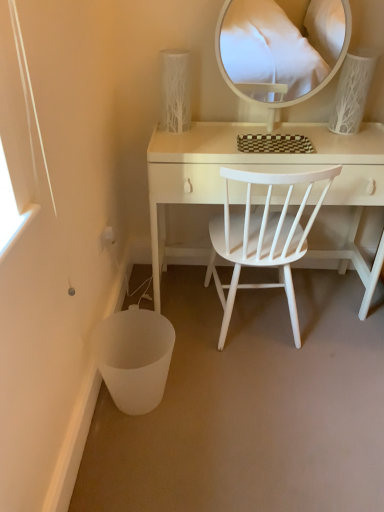
Question: From a real-world perspective, is white textured vase at upper center, the 2th table lamp viewed from the right, under white wood desk at center?

Choices:
 (A) yes
 (B) no

Answer: (B)

Question: Considering the relative sizes of white textured vase at upper center, which ranks as the 1th table lamp in left-to-right order, and white wood desk at center in the image provided, is white textured vase at upper center, which ranks as the 1th table lamp in left-to-right order, thinner than white wood desk at center?

Choices:
 (A) yes
 (B) no

Answer: (A)

Question: Is white textured vase at upper center, the 2th table lamp viewed from the right, positioned with its back to white wood desk at center?

Choices:
 (A) yes
 (B) no

Answer: (B)

Question: Is white textured vase at upper center, which ranks as the 1th table lamp in left-to-right order, smaller than white wood desk at center?

Choices:
 (A) yes
 (B) no

Answer: (A)

Question: Are white textured vase at upper center, which ranks as the 1th table lamp in left-to-right order, and white wood desk at center far apart?

Choices:
 (A) no
 (B) yes

Answer: (A)

Question: Which is correct: white wood chair at center is inside white textured vase at upper center, the 2th table lamp viewed from the right, or outside of it?

Choices:
 (A) inside
 (B) outside

Answer: (B)

Question: Looking at their shapes, would you say white wood chair at center is wider or thinner than white textured vase at upper center, which ranks as the 1th table lamp in left-to-right order?

Choices:
 (A) thin
 (B) wide

Answer: (B)

Question: In terms of height, does white wood chair at center look taller or shorter compared to white textured vase at upper center, the 2th table lamp viewed from the right?

Choices:
 (A) short
 (B) tall

Answer: (B)

Question: Is white wood chair at center bigger or smaller than white textured vase at upper center, the 2th table lamp viewed from the right?

Choices:
 (A) small
 (B) big

Answer: (B)

Question: Is white glossy mirror at upper center bigger or smaller than white wood desk at center?

Choices:
 (A) small
 (B) big

Answer: (A)

Question: From the image's perspective, is white glossy mirror at upper center above or below white wood desk at center?

Choices:
 (A) above
 (B) below

Answer: (A)

Question: In terms of width, does white glossy mirror at upper center look wider or thinner when compared to white wood desk at center?

Choices:
 (A) wide
 (B) thin

Answer: (B)

Question: Visually, is white glossy mirror at upper center positioned to the left or to the right of white wood desk at center?

Choices:
 (A) left
 (B) right

Answer: (B)

Question: Based on their positions, is white textured vase at upper right, the second table lamp positioned from the left, located to the left or right of white glossy mirror at upper center?

Choices:
 (A) left
 (B) right

Answer: (B)

Question: From a real-world perspective, is white textured vase at upper right, the 1th table lamp when ordered from right to left, above or below white glossy mirror at upper center?

Choices:
 (A) above
 (B) below

Answer: (B)